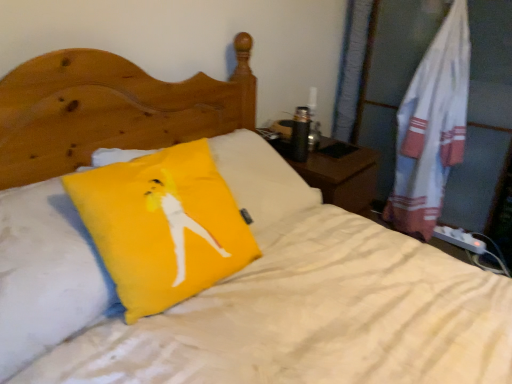
Question: Is yellow fabric pillow at center, acting as the 2th pillow starting from the left, in front of yellow fabric pillow at center, which is the first pillow in left-to-right order?

Choices:
 (A) no
 (B) yes

Answer: (A)

Question: Is yellow fabric pillow at center, acting as the 2th pillow starting from the left, aimed at yellow fabric pillow at center, which is the first pillow in left-to-right order?

Choices:
 (A) no
 (B) yes

Answer: (A)

Question: From the image's perspective, is yellow fabric pillow at center, acting as the 2th pillow starting from the left, located above yellow fabric pillow at center, placed as the second pillow when sorted from right to left?

Choices:
 (A) no
 (B) yes

Answer: (B)

Question: Considering the relative sizes of yellow fabric pillow at center, arranged as the 1th pillow when viewed from the right, and yellow fabric pillow at center, placed as the second pillow when sorted from right to left, in the image provided, is yellow fabric pillow at center, arranged as the 1th pillow when viewed from the right, shorter than yellow fabric pillow at center, placed as the second pillow when sorted from right to left,?

Choices:
 (A) no
 (B) yes

Answer: (B)

Question: Does yellow fabric pillow at center, acting as the 2th pillow starting from the left, have a lesser width compared to yellow fabric pillow at center, which is the first pillow in left-to-right order?

Choices:
 (A) no
 (B) yes

Answer: (B)

Question: Would you say yellow fabric pillow at center, placed as the second pillow when sorted from right to left, is inside or outside yellow fabric pillow at center, arranged as the 1th pillow when viewed from the right?

Choices:
 (A) inside
 (B) outside

Answer: (B)

Question: Based on their sizes in the image, would you say yellow fabric pillow at center, which is the first pillow in left-to-right order, is bigger or smaller than yellow fabric pillow at center, arranged as the 1th pillow when viewed from the right?

Choices:
 (A) small
 (B) big

Answer: (B)

Question: Considering the positions of point (1, 284) and point (181, 210), is point (1, 284) closer or farther from the camera than point (181, 210)?

Choices:
 (A) farther
 (B) closer

Answer: (B)

Question: Is yellow fabric pillow at center, placed as the second pillow when sorted from right to left, wider or thinner than yellow fabric pillow at center, arranged as the 1th pillow when viewed from the right?

Choices:
 (A) wide
 (B) thin

Answer: (A)

Question: From a real-world perspective, is white cotton towel at right positioned above or below yellow fabric pillow at center, acting as the 2th pillow starting from the left?

Choices:
 (A) below
 (B) above

Answer: (A)

Question: In terms of width, does white cotton towel at right look wider or thinner when compared to yellow fabric pillow at center, arranged as the 1th pillow when viewed from the right?

Choices:
 (A) wide
 (B) thin

Answer: (A)

Question: Considering the positions of point (420, 190) and point (150, 236), is point (420, 190) closer or farther from the camera than point (150, 236)?

Choices:
 (A) farther
 (B) closer

Answer: (A)

Question: In terms of size, does white cotton towel at right appear bigger or smaller than yellow fabric pillow at center, acting as the 2th pillow starting from the left?

Choices:
 (A) small
 (B) big

Answer: (B)

Question: Based on their positions, is white cotton towel at right located to the left or right of yellow fabric pillow at center, placed as the second pillow when sorted from right to left?

Choices:
 (A) left
 (B) right

Answer: (B)

Question: From the image's perspective, is white cotton towel at right positioned above or below yellow fabric pillow at center, which is the first pillow in left-to-right order?

Choices:
 (A) above
 (B) below

Answer: (A)